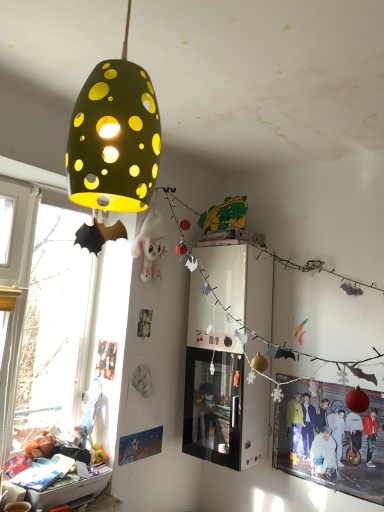
This screenshot has width=384, height=512. Find the location of `matte black poster at lower left, which ranks as the first poster page in left-to-right order`. matte black poster at lower left, which ranks as the first poster page in left-to-right order is located at coordinates (106, 359).

Locate an element on the screen. The height and width of the screenshot is (512, 384). matte green lampshade at upper left is located at coordinates (114, 137).

Is matte paper poster at lower left, which is counted as the second poster page, starting from the left, taller than red glossy poster at lower right?

Incorrect, the height of matte paper poster at lower left, which is counted as the second poster page, starting from the left, is not larger of that of red glossy poster at lower right.

Which object is thinner, matte paper poster at lower left, which is counted as the second poster page, starting from the left, or red glossy poster at lower right?

Thinner between the two is matte paper poster at lower left, which is counted as the second poster page, starting from the left.

Does matte paper poster at lower left, positioned as the 1th poster page in bottom-to-top order, turn towards red glossy poster at lower right?

Yes, matte paper poster at lower left, positioned as the 1th poster page in bottom-to-top order, is oriented towards red glossy poster at lower right.

Considering the positions of objects matte paper poster at lower left, the second poster page viewed from the top, and red glossy poster at lower right in the image provided, who is more to the left, matte paper poster at lower left, the second poster page viewed from the top, or red glossy poster at lower right?

matte paper poster at lower left, the second poster page viewed from the top, is more to the left.

Looking at this image, is matte paper poster at lower left, which is counted as the second poster page, starting from the left, looking in the opposite direction of matte green lampshade at upper left?

No, matte paper poster at lower left, which is counted as the second poster page, starting from the left, is not facing away from matte green lampshade at upper left.

Which point is more forward, (144, 449) or (121, 72)?

The point (121, 72) is closer.

Is matte paper poster at lower left, which is counted as the second poster page, starting from the left, placed right next to matte green lampshade at upper left?

No, matte paper poster at lower left, which is counted as the second poster page, starting from the left, is not touching matte green lampshade at upper left.

Based on the photo, which point is more distant from viewer, (98, 348) or (126, 441)?

Positioned behind is point (98, 348).

Can you confirm if matte black poster at lower left, which is the 2th poster page from right to left, is wider than matte paper poster at lower left, which is the first poster page from right to left?

No, matte black poster at lower left, which is the 2th poster page from right to left, is not wider than matte paper poster at lower left, which is the first poster page from right to left.

From the image's perspective, is matte black poster at lower left, the 1th poster page from the top, below matte paper poster at lower left, which is counted as the second poster page, starting from the left?

No, from the image's perspective, matte black poster at lower left, the 1th poster page from the top, is not beneath matte paper poster at lower left, which is counted as the second poster page, starting from the left.

Is red glossy poster at lower right located outside matte green lampshade at upper left?

red glossy poster at lower right is positioned outside matte green lampshade at upper left.

From a real-world perspective, is red glossy poster at lower right positioned above or below matte green lampshade at upper left?

red glossy poster at lower right is below matte green lampshade at upper left.

Where is `person below the matte green lampshade at upper left (from the image's perspective)`? This screenshot has height=512, width=384. person below the matte green lampshade at upper left (from the image's perspective) is located at coordinates (330, 437).

Which is closer, (x=128, y=25) or (x=131, y=459)?

Point (x=128, y=25).

How much distance is there between matte green lampshade at upper left and matte paper poster at lower left, the second poster page viewed from the top?

6.16 feet.

From a real-world perspective, who is located lower, matte green lampshade at upper left or matte paper poster at lower left, which is the first poster page from right to left?

matte paper poster at lower left, which is the first poster page from right to left, from a real-world perspective.

Is matte paper poster at lower left, which is the first poster page from right to left, inside the boundaries of matte black poster at lower left, which is the 2th poster page from right to left, or outside?

matte paper poster at lower left, which is the first poster page from right to left, is not inside matte black poster at lower left, which is the 2th poster page from right to left, it's outside.

Does matte paper poster at lower left, which is the first poster page from right to left, have a greater height compared to matte black poster at lower left, which is the 2th poster page from right to left?

Incorrect, the height of matte paper poster at lower left, which is the first poster page from right to left, is not larger of that of matte black poster at lower left, which is the 2th poster page from right to left.

In the scene shown: From the image's perspective, which object appears higher, matte paper poster at lower left, which is counted as the second poster page, starting from the left, or matte black poster at lower left, the 1th poster page from the top?

matte black poster at lower left, the 1th poster page from the top.

In the scene shown: Is matte paper poster at lower left, which is the first poster page from right to left, with matte black poster at lower left, which ranks as the first poster page in left-to-right order?

No, matte paper poster at lower left, which is the first poster page from right to left, is not next to matte black poster at lower left, which ranks as the first poster page in left-to-right order.

Is matte black poster at lower left, which ranks as the first poster page in left-to-right order, inside the boundaries of matte green lampshade at upper left, or outside?

The correct answer is: outside.

Considering the sizes of objects matte black poster at lower left, which ranks as the first poster page in left-to-right order, and matte green lampshade at upper left in the image provided, who is shorter, matte black poster at lower left, which ranks as the first poster page in left-to-right order, or matte green lampshade at upper left?

matte black poster at lower left, which ranks as the first poster page in left-to-right order, is shorter.

Considering the relative positions of matte black poster at lower left, which is the 2th poster page from right to left, and matte green lampshade at upper left in the image provided, is matte black poster at lower left, which is the 2th poster page from right to left, behind matte green lampshade at upper left?

Yes.

Where is `poster page located underneath the red glossy poster at lower right (from a real-world perspective)`? This screenshot has height=512, width=384. poster page located underneath the red glossy poster at lower right (from a real-world perspective) is located at coordinates (140, 445).

Where is `the 1st poster page to the left of the matte green lampshade at upper left, counting from the anchor's position`? The image size is (384, 512). the 1st poster page to the left of the matte green lampshade at upper left, counting from the anchor's position is located at coordinates (140, 445).

Consider the image. Based on their spatial positions, is red glossy poster at lower right or matte paper poster at lower left, which is the first poster page from right to left, further from matte black poster at lower left, which ranks as the first poster page in left-to-right order?

red glossy poster at lower right is positioned further to the anchor matte black poster at lower left, which ranks as the first poster page in left-to-right order.

Based on their spatial positions, is red glossy poster at lower right or matte green lampshade at upper left further from matte black poster at lower left, placed as the second poster page when sorted from bottom to top?

matte green lampshade at upper left is positioned further to the anchor matte black poster at lower left, placed as the second poster page when sorted from bottom to top.

From the image, which object appears to be nearer to matte black poster at lower left, which is the 2th poster page from right to left, matte green lampshade at upper left or matte paper poster at lower left, the second poster page viewed from the top?

matte paper poster at lower left, the second poster page viewed from the top, is closer to matte black poster at lower left, which is the 2th poster page from right to left.

Considering their positions, is matte green lampshade at upper left positioned closer to matte paper poster at lower left, positioned as the 1th poster page in bottom-to-top order, than red glossy poster at lower right?

red glossy poster at lower right is positioned closer to the anchor matte paper poster at lower left, positioned as the 1th poster page in bottom-to-top order.

Estimate the real-world distances between objects in this image. Which object is further from matte green lampshade at upper left, matte black poster at lower left, which is the 2th poster page from right to left, or matte paper poster at lower left, positioned as the 1th poster page in bottom-to-top order?

The object further to matte green lampshade at upper left is matte paper poster at lower left, positioned as the 1th poster page in bottom-to-top order.

Considering their positions, is matte green lampshade at upper left positioned closer to red glossy poster at lower right than matte black poster at lower left, placed as the second poster page when sorted from bottom to top?

matte black poster at lower left, placed as the second poster page when sorted from bottom to top, is positioned closer to the anchor red glossy poster at lower right.

Looking at the image, which one is located further to red glossy poster at lower right, matte paper poster at lower left, which is the first poster page from right to left, or matte green lampshade at upper left?

matte green lampshade at upper left is further to red glossy poster at lower right.

Estimate the real-world distances between objects in this image. Which object is closer to matte paper poster at lower left, the second poster page viewed from the top, red glossy poster at lower right or matte green lampshade at upper left?

red glossy poster at lower right.

Locate an element on the screen. The width and height of the screenshot is (384, 512). person between matte green lampshade at upper left and matte black poster at lower left, which ranks as the first poster page in left-to-right order, from front to back is located at coordinates (330, 437).

The image size is (384, 512). I want to click on person between matte green lampshade at upper left and matte paper poster at lower left, which is the first poster page from right to left, from front to back, so click(x=330, y=437).

This screenshot has width=384, height=512. In order to click on poster page positioned between matte green lampshade at upper left and matte black poster at lower left, the 1th poster page from the top, from near to far in this screenshot , I will do `click(140, 445)`.

Identify the location of poster page between matte black poster at lower left, the 1th poster page from the top, and red glossy poster at lower right from left to right. The height and width of the screenshot is (512, 384). (140, 445).